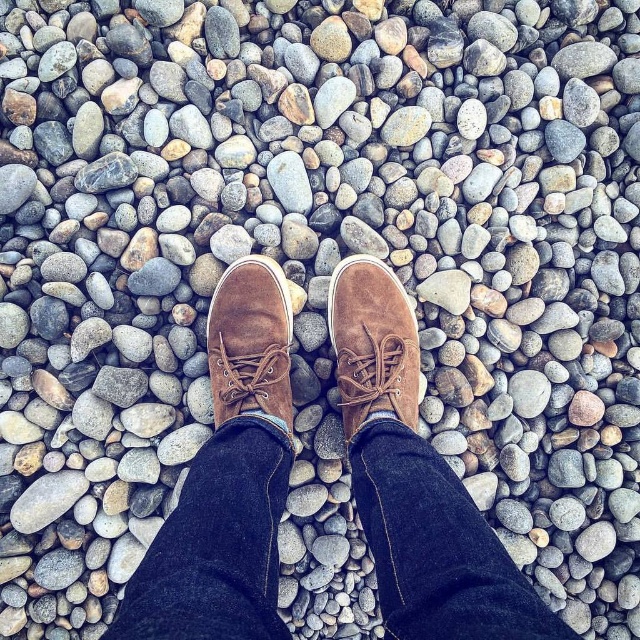
Measure the distance between denim at center and suede brown boot at center.

A: 27.61 centimeters

Who is shorter, denim at center or suede brown boot at center?

suede brown boot at center

Which is behind, point (257, 621) or point (280, 388)?

The point (280, 388) is more distant.

The width and height of the screenshot is (640, 640). I want to click on denim at center, so click(x=436, y=547).

Is the position of denim at center more distant than that of suede brown shoe at center?

No, denim at center is in front of suede brown shoe at center.

Which is above, denim at center or suede brown shoe at center?

suede brown shoe at center is above.

Which is in front, point (397, 538) or point (412, 323)?

Point (397, 538)

Where is `denim at center`? The height and width of the screenshot is (640, 640). denim at center is located at coordinates (436, 547).

Does suede brown shoe at center lie in front of suede brown boot at center?

No, it is not.

Find the location of a particular element. This screenshot has width=640, height=640. suede brown shoe at center is located at coordinates (372, 344).

Between point (410, 408) and point (273, 368), which one is positioned in front?

Point (410, 408) is more forward.

You are a GUI agent. You are given a task and a screenshot of the screen. Output one action in this format:
    pyautogui.click(x=<x>, y=<y>)
    Task: Click on the suede brown shoe at center
    The width and height of the screenshot is (640, 640).
    Given the screenshot: What is the action you would take?
    point(372,344)